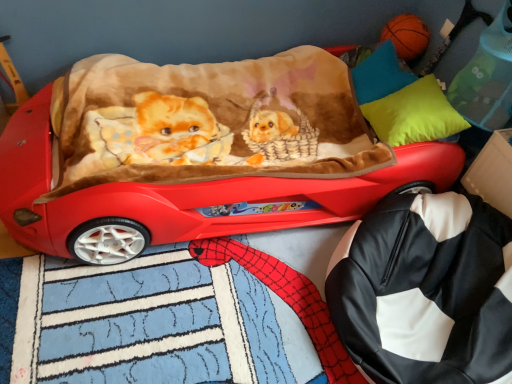
Question: Is black leather bag at lower right positioned with its back to matte blue pillow at upper right, the 2th pillow when ordered from bottom to top?

Choices:
 (A) yes
 (B) no

Answer: (B)

Question: Can you confirm if black leather bag at lower right is positioned to the right of matte blue pillow at upper right, the 2th pillow when ordered from bottom to top?

Choices:
 (A) no
 (B) yes

Answer: (B)

Question: Can you confirm if black leather bag at lower right is shorter than matte blue pillow at upper right, positioned as the 1th pillow in top-to-bottom order?

Choices:
 (A) no
 (B) yes

Answer: (A)

Question: Considering the relative sizes of black leather bag at lower right and matte blue pillow at upper right, the 2th pillow when ordered from bottom to top, in the image provided, is black leather bag at lower right thinner than matte blue pillow at upper right, the 2th pillow when ordered from bottom to top,?

Choices:
 (A) no
 (B) yes

Answer: (A)

Question: Can you confirm if black leather bag at lower right is positioned to the left of matte blue pillow at upper right, the 2th pillow when ordered from bottom to top?

Choices:
 (A) yes
 (B) no

Answer: (B)

Question: From the image's perspective, is matte blue pillow at upper right, the 2th pillow when ordered from bottom to top, positioned above or below black leather bag at lower right?

Choices:
 (A) above
 (B) below

Answer: (A)

Question: Relative to black leather bag at lower right, is matte blue pillow at upper right, the 2th pillow when ordered from bottom to top, in front or behind?

Choices:
 (A) behind
 (B) front

Answer: (A)

Question: Based on their sizes in the image, would you say matte blue pillow at upper right, the 2th pillow when ordered from bottom to top, is bigger or smaller than black leather bag at lower right?

Choices:
 (A) big
 (B) small

Answer: (B)

Question: In terms of height, does matte blue pillow at upper right, positioned as the 1th pillow in top-to-bottom order, look taller or shorter compared to black leather bag at lower right?

Choices:
 (A) short
 (B) tall

Answer: (A)

Question: From a real-world perspective, is matte blue pillow at upper right, the 2th pillow when ordered from bottom to top, above or below shiny red car at center?

Choices:
 (A) below
 (B) above

Answer: (B)

Question: Is point click(397, 77) positioned closer to the camera than point click(189, 216)?

Choices:
 (A) closer
 (B) farther

Answer: (B)

Question: From the image's perspective, relative to shiny red car at center, is matte blue pillow at upper right, positioned as the 1th pillow in top-to-bottom order, above or below?

Choices:
 (A) above
 (B) below

Answer: (A)

Question: Which is correct: matte blue pillow at upper right, positioned as the 1th pillow in top-to-bottom order, is inside shiny red car at center, or outside of it?

Choices:
 (A) inside
 (B) outside

Answer: (A)

Question: From the image's perspective, is shiny red car at center located above or below neon yellow fabric pillow at upper right, which ranks as the first pillow in bottom-to-top order?

Choices:
 (A) above
 (B) below

Answer: (B)

Question: From their relative heights in the image, would you say shiny red car at center is taller or shorter than neon yellow fabric pillow at upper right, the second pillow in the top-to-bottom sequence?

Choices:
 (A) short
 (B) tall

Answer: (B)